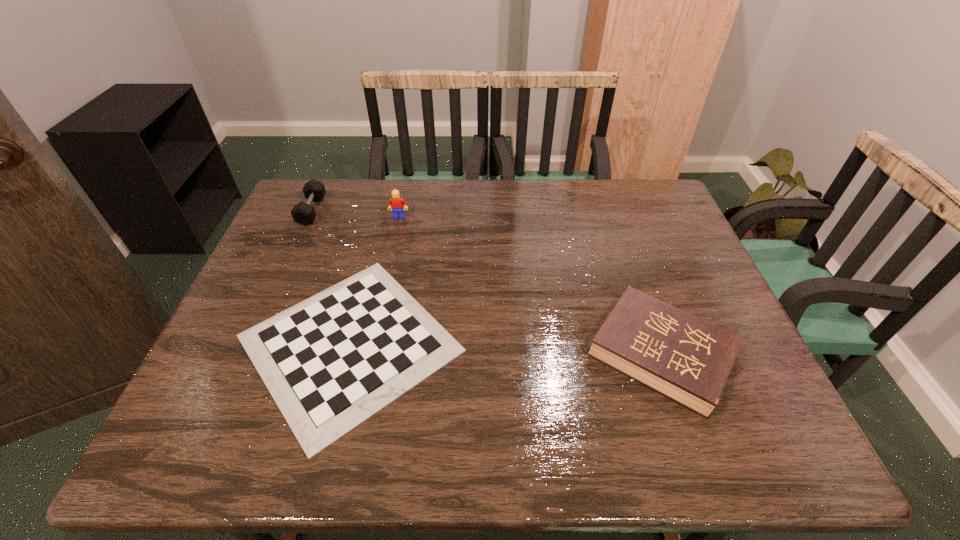
You are a GUI agent. You are given a task and a screenshot of the screen. Output one action in this format:
    pyautogui.click(x=<x>, y=<y>)
    Task: Click on the Lego
    The height and width of the screenshot is (540, 960).
    Given the screenshot: What is the action you would take?
    coord(396,203)

Where is `dumbbell`? dumbbell is located at coordinates (303, 213).

The image size is (960, 540). In order to click on hardback book in this screenshot , I will do `click(684, 358)`.

This screenshot has height=540, width=960. I want to click on the rightmost object, so click(684, 358).

I want to click on the shortest object, so click(330, 362).

Where is `free space located 0.180m on the face of the Lego`? free space located 0.180m on the face of the Lego is located at coordinates (391, 258).

This screenshot has height=540, width=960. In order to click on blank area located on the front of the dumbbell in this screenshot , I will do `click(271, 303)`.

I want to click on blank space located on the left of the rightmost object, so click(x=483, y=354).

You are a GUI agent. You are given a task and a screenshot of the screen. Output one action in this format:
    pyautogui.click(x=<x>, y=<y>)
    Task: Click on the vacant position located 0.310m on the right of the chessboard
    The width and height of the screenshot is (960, 540).
    Given the screenshot: What is the action you would take?
    pyautogui.click(x=598, y=343)

The image size is (960, 540). I want to click on Lego positioned at the far edge, so pyautogui.click(x=396, y=203).